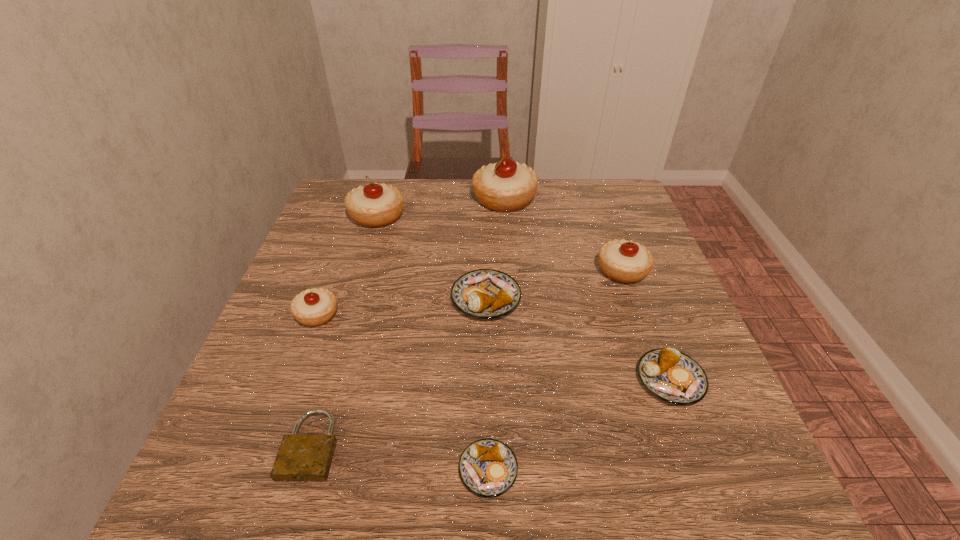
You are a GUI agent. You are given a task and a screenshot of the screen. Output one action in this format:
    pyautogui.click(x=<x>, y=<y>)
    Task: Click on the free space between the padlock and the sixth tallest object
    This screenshot has height=540, width=960.
    Given the screenshot: What is the action you would take?
    pyautogui.click(x=491, y=413)

Identify the location of object that is the fourth closest to the biggest beige pastry. The image size is (960, 540). (313, 307).

The height and width of the screenshot is (540, 960). In order to click on object that is the seventh closest to the tallest object in this screenshot , I will do `click(488, 468)`.

The width and height of the screenshot is (960, 540). I want to click on the sixth closest pastry relative to the smallest beige pastry, so click(x=672, y=376).

You are a GUI agent. You are given a task and a screenshot of the screen. Output one action in this format:
    pyautogui.click(x=<x>, y=<y>)
    Task: Click on the third closest pastry to the shortest object
    The height and width of the screenshot is (540, 960).
    Given the screenshot: What is the action you would take?
    pyautogui.click(x=484, y=293)

Locate which beige pastry ranks second in proximity to the biggest beige pastry. Please provide its 2D coordinates. Your answer should be formatted as a tuple, i.e. [(x, y)], where the tuple contains the x and y coordinates of a point satisfying the conditions above.

[(625, 261)]

The width and height of the screenshot is (960, 540). What are the coordinates of `the fourth closest beige pastry to the second smallest brown pastry` in the screenshot? It's located at (374, 205).

Where is `the closest brown pastry to the farthest brown pastry`? the closest brown pastry to the farthest brown pastry is located at coordinates [672, 376].

Choose which brown pastry is the second nearest neighbor to the shortest pastry. Please provide its 2D coordinates. Your answer should be formatted as a tuple, i.e. [(x, y)], where the tuple contains the x and y coordinates of a point satisfying the conditions above.

[(484, 293)]

Identify the location of vacant position in the image that satisfies the following two spatial constraints: 1. on the back side of the biggest brown pastry; 2. on the left side of the third tallest pastry. point(486,270).